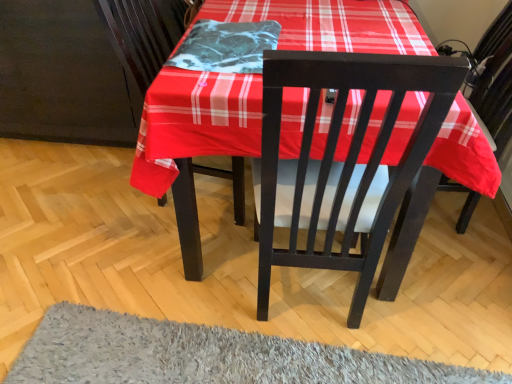
Locate an element on the screen. The height and width of the screenshot is (384, 512). free space above marble-like fabric at center (from a real-world perspective) is located at coordinates (236, 31).